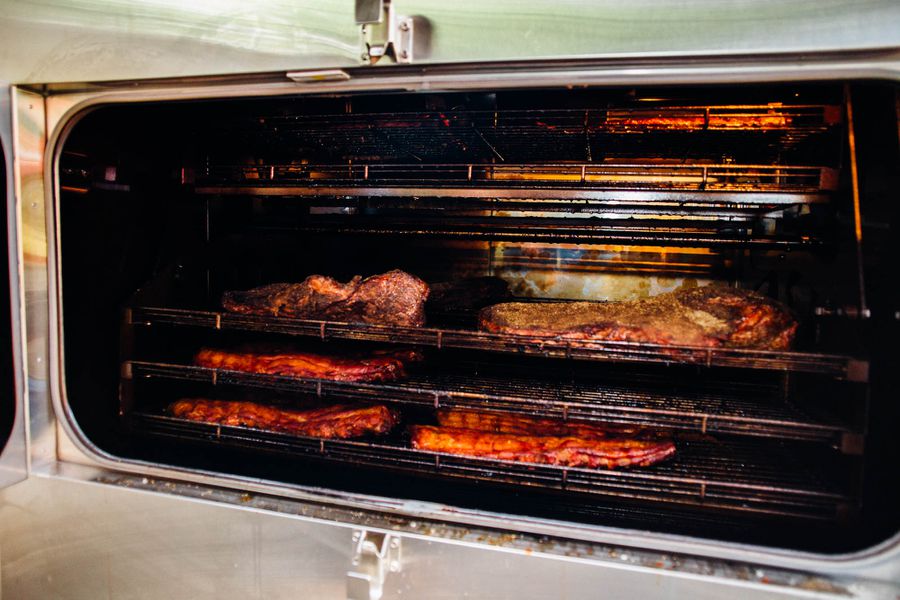
Image resolution: width=900 pixels, height=600 pixels. I want to click on bottom rack, so (x=696, y=485).